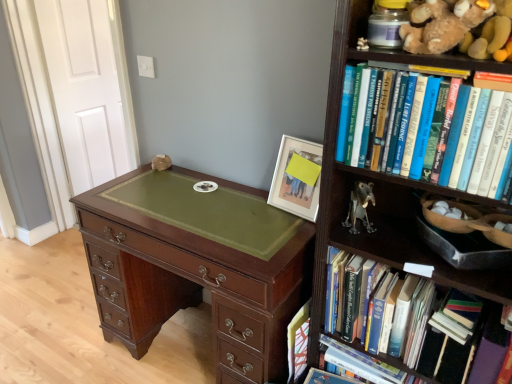
Identify the location of hardcover book at center right, placed as the first book when sorted from top to bottom. point(476,141).

In order to face dark wood bookcase at right, should I rotate leftwards or rightwards?

Rotate your view right by about 21.613°.

You are a GUI agent. You are given a task and a screenshot of the screen. Output one action in this format:
    pyautogui.click(x=<x>, y=<y>)
    Task: Click on the hardcover books at right, acting as the second book starting from the bottom
    
    Given the screenshot: What is the action you would take?
    pyautogui.click(x=398, y=321)

Measure the distance between hardcover books at right, the second book from the top, and camera.

They are 1.08 meters apart.

The height and width of the screenshot is (384, 512). Identify the location of hardcover book at center, the first book when ordered from bottom to top. (298, 342).

How distant is hardcover book at center, arranged as the third book when viewed from the top, from hardcover books at right, the second book from the top?

hardcover book at center, arranged as the third book when viewed from the top, and hardcover books at right, the second book from the top, are 30.01 centimeters apart.

From a real-world perspective, is hardcover book at center, the first book when ordered from bottom to top, physically below hardcover books at right, the second book from the top?

Yes, from a real-world perspective, hardcover book at center, the first book when ordered from bottom to top, is under hardcover books at right, the second book from the top.

Starting from the hardcover book at center, arranged as the third book when viewed from the top, which book is the 1st one in front? Please provide its 2D coordinates.

[(398, 321)]

How different are the orientations of hardcover book at center, arranged as the third book when viewed from the top, and hardcover books at right, the second book from the top, in degrees?

There is a 1.76-degree angle between the facing directions of hardcover book at center, arranged as the third book when viewed from the top, and hardcover books at right, the second book from the top.

Is soft brown plush at upper right closer to camera compared to metallic gray figurine at center-right?

Yes, soft brown plush at upper right is closer to the camera.

Consider the image. Measure the distance from soft brown plush at upper right to metallic gray figurine at center-right.

soft brown plush at upper right and metallic gray figurine at center-right are 20.20 inches apart.

Is soft brown plush at upper right oriented away from metallic gray figurine at center-right?

No, soft brown plush at upper right is not facing away from metallic gray figurine at center-right.

From the image's perspective, is hardcover books at right, the second book from the top, located above or below soft brown plush at upper right?

Based on their image positions, hardcover books at right, the second book from the top, is located beneath soft brown plush at upper right.

From a real-world perspective, is hardcover books at right, acting as the second book starting from the bottom, physically located above or below soft brown plush at upper right?

In terms of real-world spatial position, hardcover books at right, acting as the second book starting from the bottom, is below soft brown plush at upper right.

Which object is thinner, hardcover books at right, the second book from the top, or soft brown plush at upper right?

With smaller width is soft brown plush at upper right.

Looking at the image, does hardcover books at right, the second book from the top, seem bigger or smaller compared to soft brown plush at upper right?

Clearly, hardcover books at right, the second book from the top, is larger in size than soft brown plush at upper right.

Considering the relative sizes of matte wooden picture frame at upper center and dark wood bookcase at right in the image provided, is matte wooden picture frame at upper center smaller than dark wood bookcase at right?

Yes.

Based on their positions, is matte wooden picture frame at upper center located to the left or right of dark wood bookcase at right?

Clearly, matte wooden picture frame at upper center is on the left of dark wood bookcase at right in the image.

In the scene shown: Is dark wood bookcase at right located within matte wooden picture frame at upper center?

No, matte wooden picture frame at upper center does not contain dark wood bookcase at right.

Is matte wooden picture frame at upper center positioned with its back to soft brown plush at upper right?

No, soft brown plush at upper right is not at the back of matte wooden picture frame at upper center.

From the image's perspective, is matte wooden picture frame at upper center over soft brown plush at upper right?

No, from the image's perspective, matte wooden picture frame at upper center is not over soft brown plush at upper right.

Based on the photo, can soft brown plush at upper right be found inside matte wooden picture frame at upper center?

No.

How different are the orientations of matte wooden picture frame at upper center and soft brown plush at upper right in degrees?

The angular difference between matte wooden picture frame at upper center and soft brown plush at upper right is 7.75 degrees.

From their relative heights in the image, would you say hardcover book at center right, the third book ordered from the bottom, is taller or shorter than mahogany wood chest of drawers at center?

In the image, hardcover book at center right, the third book ordered from the bottom, appears to be shorter than mahogany wood chest of drawers at center.

Based on their positions, is hardcover book at center right, placed as the first book when sorted from top to bottom, located to the left or right of mahogany wood chest of drawers at center?

From the image, it's evident that hardcover book at center right, placed as the first book when sorted from top to bottom, is to the right of mahogany wood chest of drawers at center.

In the image, is hardcover book at center right, the third book ordered from the bottom, positioned in front of or behind mahogany wood chest of drawers at center?

In the image, hardcover book at center right, the third book ordered from the bottom, appears in front of mahogany wood chest of drawers at center.

Which is behind, point (425, 138) or point (119, 234)?

Point (119, 234)

From the image's perspective, is hardcover book at center right, placed as the first book when sorted from top to bottom, above or below hardcover book at center, the first book when ordered from bottom to top?

Clearly, from the image's perspective, hardcover book at center right, placed as the first book when sorted from top to bottom, is above hardcover book at center, the first book when ordered from bottom to top.

Does hardcover book at center right, the third book ordered from the bottom, appear on the left side of hardcover book at center, the first book when ordered from bottom to top?

Incorrect, hardcover book at center right, the third book ordered from the bottom, is not on the left side of hardcover book at center, the first book when ordered from bottom to top.

Do you think hardcover book at center right, the third book ordered from the bottom, is within hardcover book at center, the first book when ordered from bottom to top, or outside of it?

hardcover book at center right, the third book ordered from the bottom, exists outside the volume of hardcover book at center, the first book when ordered from bottom to top.

Between hardcover book at center right, placed as the first book when sorted from top to bottom, and hardcover book at center, arranged as the third book when viewed from the top, which one has larger width?

Wider between the two is hardcover book at center right, placed as the first book when sorted from top to bottom.

This screenshot has height=384, width=512. I want to click on the 2nd book to the left of the hardcover books at right, acting as the second book starting from the bottom, starting your count from the anchor, so click(298, 342).

At what (x,y) coordinates should I click in order to perform the action: click on teddy above the metallic gray figurine at center-right (from a real-world perspective). Please return your answer as a coordinate pair (x, y). The height and width of the screenshot is (384, 512). Looking at the image, I should click on (442, 24).

From the image, which object appears to be nearer to hardcover books at right, acting as the second book starting from the bottom, hardcover book at center right, the third book ordered from the bottom, or metallic gray figurine at center-right?

metallic gray figurine at center-right is closer to hardcover books at right, acting as the second book starting from the bottom.

Considering their positions, is soft brown plush at upper right positioned closer to hardcover book at center right, the third book ordered from the bottom, than hardcover books at right, acting as the second book starting from the bottom?

soft brown plush at upper right is positioned closer to the anchor hardcover book at center right, the third book ordered from the bottom.

From the image, which object appears to be nearer to hardcover book at center right, the third book ordered from the bottom, mahogany wood chest of drawers at center or dark wood bookcase at right?

The object closer to hardcover book at center right, the third book ordered from the bottom, is dark wood bookcase at right.

From the picture: When comparing their distances from soft brown plush at upper right, does hardcover book at center right, the third book ordered from the bottom, or mahogany wood chest of drawers at center seem further?

mahogany wood chest of drawers at center is further to soft brown plush at upper right.

Looking at this image, based on their spatial positions, is mahogany wood chest of drawers at center or hardcover books at right, acting as the second book starting from the bottom, closer to matte wooden picture frame at upper center?

The object closer to matte wooden picture frame at upper center is mahogany wood chest of drawers at center.

Which object lies nearer to the anchor point soft brown plush at upper right, hardcover book at center right, the third book ordered from the bottom, or matte wooden picture frame at upper center?

Based on the image, hardcover book at center right, the third book ordered from the bottom, appears to be nearer to soft brown plush at upper right.

Looking at the image, which one is located further to hardcover books at right, the second book from the top, matte wooden picture frame at upper center or mahogany wood chest of drawers at center?

mahogany wood chest of drawers at center is further to hardcover books at right, the second book from the top.

Considering their positions, is metallic gray figurine at center-right positioned closer to hardcover book at center, the first book when ordered from bottom to top, than hardcover book at center right, placed as the first book when sorted from top to bottom?

Based on the image, metallic gray figurine at center-right appears to be nearer to hardcover book at center, the first book when ordered from bottom to top.

Identify the location of picture frame between soft brown plush at upper right and hardcover book at center, the first book when ordered from bottom to top, from top to bottom. [x=297, y=178].

Find the location of a particular element. picture frame situated between mahogany wood chest of drawers at center and hardcover book at center right, the third book ordered from the bottom, from left to right is located at coordinates (297, 178).

You are a GUI agent. You are given a task and a screenshot of the screen. Output one action in this format:
    pyautogui.click(x=<x>, y=<y>)
    Task: Click on the chest of drawers positioned between dark wood bookcase at right and matte wooden picture frame at upper center from near to far
    
    Given the screenshot: What is the action you would take?
    pyautogui.click(x=197, y=265)

This screenshot has width=512, height=384. In order to click on toy between mahogany wood chest of drawers at center and dark wood bookcase at right in the horizontal direction in this screenshot , I will do `click(360, 207)`.